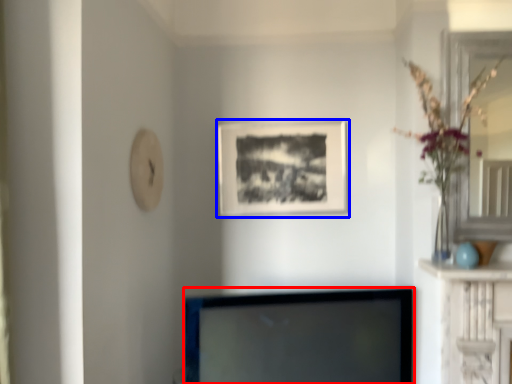
Question: Which of the following is the closest to the observer, television (highlighted by a red box) or picture frame (highlighted by a blue box)?

Choices:
 (A) television
 (B) picture frame

Answer: (A)